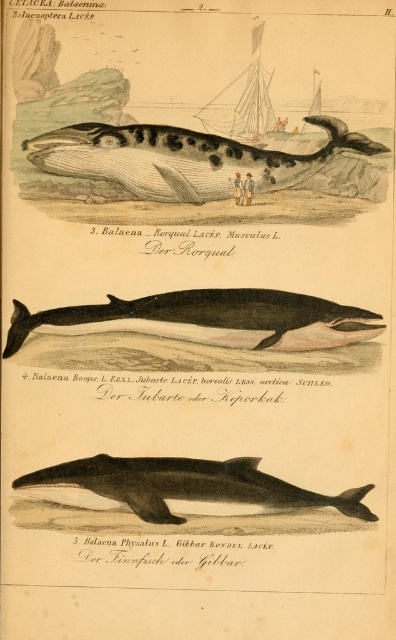
Can you confirm if speckled gray whale at center is positioned below wooden sailboat at upper center?

Yes, speckled gray whale at center is below wooden sailboat at upper center.

Does speckled gray whale at center appear on the right side of wooden sailboat at upper center?

No, speckled gray whale at center is not to the right of wooden sailboat at upper center.

Which is behind, point (260, 189) or point (253, 36)?

The point (260, 189) is more distant.

Find the location of a particular element. The width and height of the screenshot is (396, 640). speckled gray whale at center is located at coordinates (207, 161).

Does point (331, 140) come closer to viewer compared to point (13, 310)?

Yes, point (331, 140) is closer to viewer.

Who is higher up, speckled gray whale at center or smooth black whale at center?

Positioned higher is speckled gray whale at center.

Locate an element on the screen. The image size is (396, 640). speckled gray whale at center is located at coordinates (207, 161).

You are a GUI agent. You are given a task and a screenshot of the screen. Output one action in this format:
    pyautogui.click(x=<x>, y=<y>)
    Task: Click on the speckled gray whale at center
    This screenshot has width=396, height=640.
    Given the screenshot: What is the action you would take?
    pyautogui.click(x=207, y=161)

Can you confirm if smooth gray dolphin at center is positioned above wooden sailboat at upper center?

Incorrect, smooth gray dolphin at center is not positioned above wooden sailboat at upper center.

Can you confirm if smooth gray dolphin at center is positioned below wooden sailboat at upper center?

Indeed, smooth gray dolphin at center is positioned under wooden sailboat at upper center.

Between point (180, 476) and point (237, 104), which one is positioned behind?

Point (180, 476)

This screenshot has width=396, height=640. What are the coordinates of `smooth gray dolphin at center` in the screenshot? It's located at (188, 484).